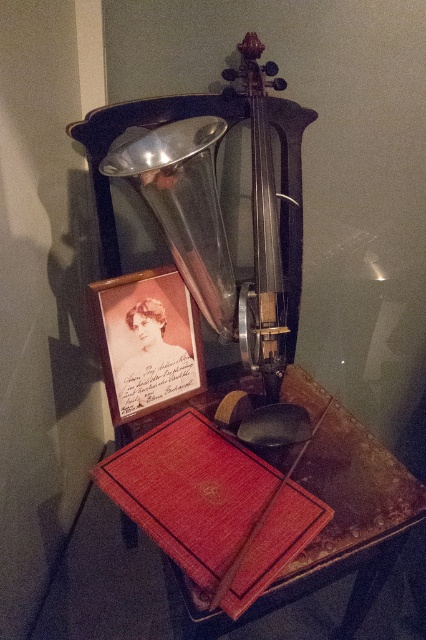
Which is above, red leather book at center or dark brown polished wood violin at center?

Positioned higher is dark brown polished wood violin at center.

Can you confirm if red leather book at center is positioned to the left of dark brown polished wood violin at center?

Indeed, red leather book at center is positioned on the left side of dark brown polished wood violin at center.

Between point (150, 461) and point (261, 371), which one is positioned in front?

Point (150, 461) is more forward.

I want to click on red leather book at center, so tap(213, 508).

Does point (134, 368) lie in front of point (273, 198)?

No, (134, 368) is further to viewer.

What do you see at coordinates (146, 340) in the screenshot? The height and width of the screenshot is (640, 426). I see `matte cardboard photo frame at center-left` at bounding box center [146, 340].

The image size is (426, 640). What are the coordinates of `matte cardboard photo frame at center-left` in the screenshot? It's located at (146, 340).

Between red leather book at lower center and dark brown polished wood violin at center, which one appears on the right side from the viewer's perspective?

From the viewer's perspective, red leather book at lower center appears more on the right side.

Is red leather book at lower center below dark brown polished wood violin at center?

Indeed, red leather book at lower center is positioned under dark brown polished wood violin at center.

Find the location of `red leather book at lower center`. red leather book at lower center is located at coordinates (347, 506).